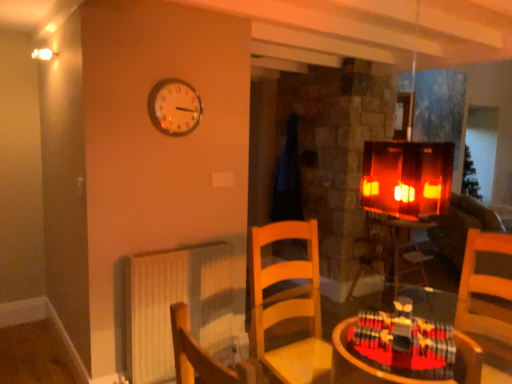
Question: From the image's perspective, relative to velvet brown couch at right, is white textured radiator at lower left above or below?

Choices:
 (A) above
 (B) below

Answer: (B)

Question: Is white textured radiator at lower left bigger or smaller than velvet brown couch at right?

Choices:
 (A) big
 (B) small

Answer: (B)

Question: Which of these objects is positioned farthest from the velvet brown couch at right?

Choices:
 (A) wooden table at lower right, which appears as the first table when viewed from the left
 (B) white textured radiator at lower left
 (C) metallic round clock at upper center
 (D) wooden table at center, placed as the 2th table when sorted from front to back

Answer: (A)

Question: Which of these objects is positioned farthest from the wooden table at lower right, which is the second table in back-to-front order?

Choices:
 (A) metallic round clock at upper center
 (B) wooden table at center, which is the 2th table from top to bottom
 (C) velvet brown couch at right
 (D) white textured radiator at lower left

Answer: (C)